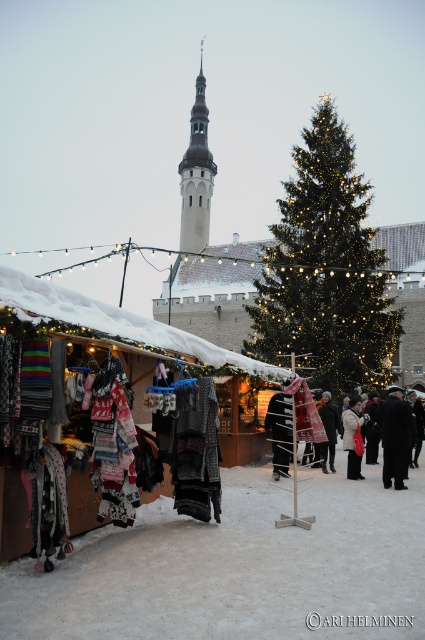
Image resolution: width=425 pixels, height=640 pixels. What do you see at coordinates (396, 436) in the screenshot?
I see `black wool coat at center` at bounding box center [396, 436].

Between point (402, 470) and point (329, 467), which one is positioned behind?

Point (329, 467)

I want to click on black wool coat at center, so click(396, 436).

Does black wool coat at center appear on the left side of dark wool coat at center?

Yes, black wool coat at center is to the left of dark wool coat at center.

Describe the element at coordinates (396, 436) in the screenshot. This screenshot has width=425, height=640. I see `black wool coat at center` at that location.

Which is behind, point (388, 397) or point (419, 404)?

Positioned behind is point (419, 404).

Where is `black wool coat at center`? The height and width of the screenshot is (640, 425). black wool coat at center is located at coordinates (396, 436).

Is point (334, 172) farther from viewer compared to point (391, 442)?

That is True.

Is illuminated green pine at center further to the viewer compared to black wool coat at center?

Yes, it is behind black wool coat at center.

Who is more distant from viewer, (340,168) or (394,442)?

The point (340,168) is behind.

I want to click on illuminated green pine at center, so click(x=325, y=269).